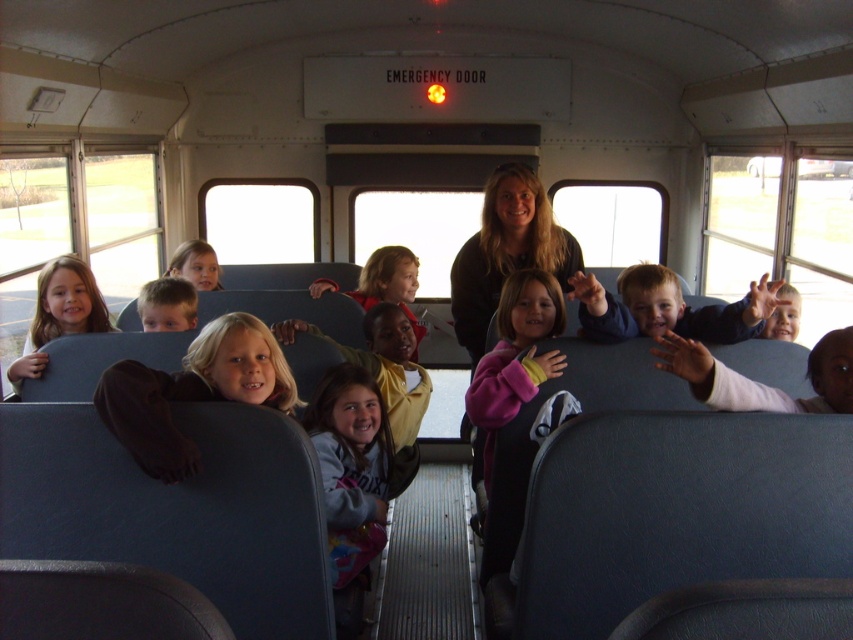
Which is more to the left, gray fleece jacket at center or matte yellow jacket at center?

Positioned to the left is matte yellow jacket at center.

From the picture: Between gray fleece jacket at center and matte yellow jacket at center, which one has more height?

gray fleece jacket at center is taller.

Between point (335, 566) and point (375, 376), which one is positioned behind?

Positioned behind is point (375, 376).

The width and height of the screenshot is (853, 640). Find the location of `gray fleece jacket at center`. gray fleece jacket at center is located at coordinates (350, 467).

Between brown fleece jacket at lower left and blonde hair at center, which one has less height?

With less height is blonde hair at center.

Identify the location of brown fleece jacket at lower left. The image size is (853, 640). (192, 392).

This screenshot has width=853, height=640. I want to click on pink fleece jacket at center, so click(x=515, y=355).

Between point (531, 284) and point (41, 273), which one is positioned behind?

The point (41, 273) is more distant.

Is point (502, 372) closer to camera compared to point (28, 328)?

Yes, point (502, 372) is closer to viewer.

Identify the location of pink fleece jacket at center. (515, 355).